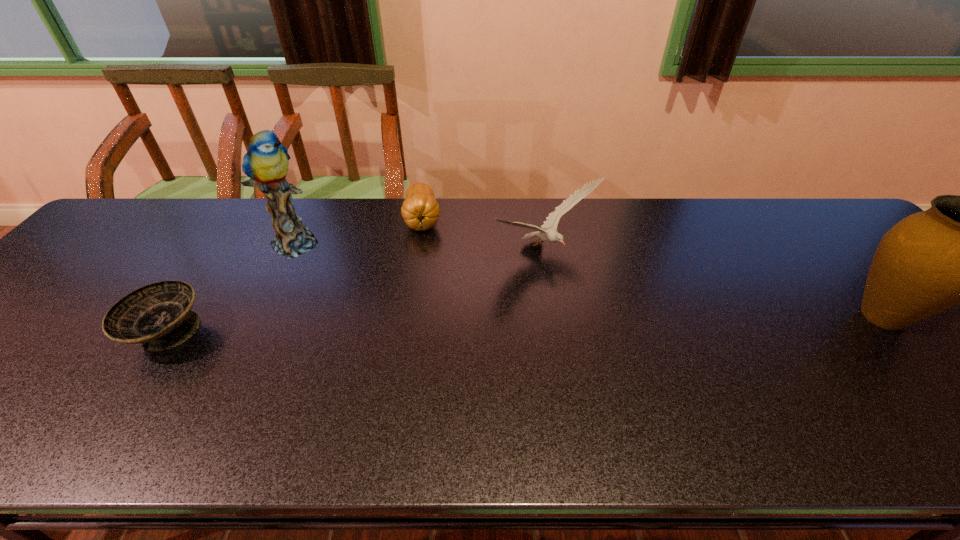
At what (x,y) coordinates should I click in order to perform the action: click on vacant spot on the desktop that is between the shortest object and the rightmost object and is positioned on the stem side of the gourd. Please return your answer as a coordinate pair (x, y). The image size is (960, 540). Looking at the image, I should click on (430, 327).

Identify the location of vacant space on the desktop that is between the bowl and the rightmost object and is positioned on the face of the second object from left to right. pyautogui.click(x=449, y=326).

At what (x,y) coordinates should I click in order to perform the action: click on vacant space on the desktop that is between the leftmost object and the second tallest object and is positioned at the tip of the beak of the fourth object from left to right. Please return your answer as a coordinate pair (x, y). This screenshot has width=960, height=540. Looking at the image, I should click on (630, 322).